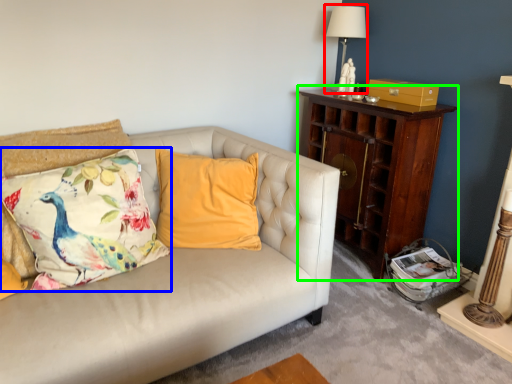
Question: Which object is positioned farthest from table lamp (highlighted by a red box)? Select from pillow (highlighted by a blue box) and nightstand (highlighted by a green box).

Choices:
 (A) pillow
 (B) nightstand

Answer: (A)